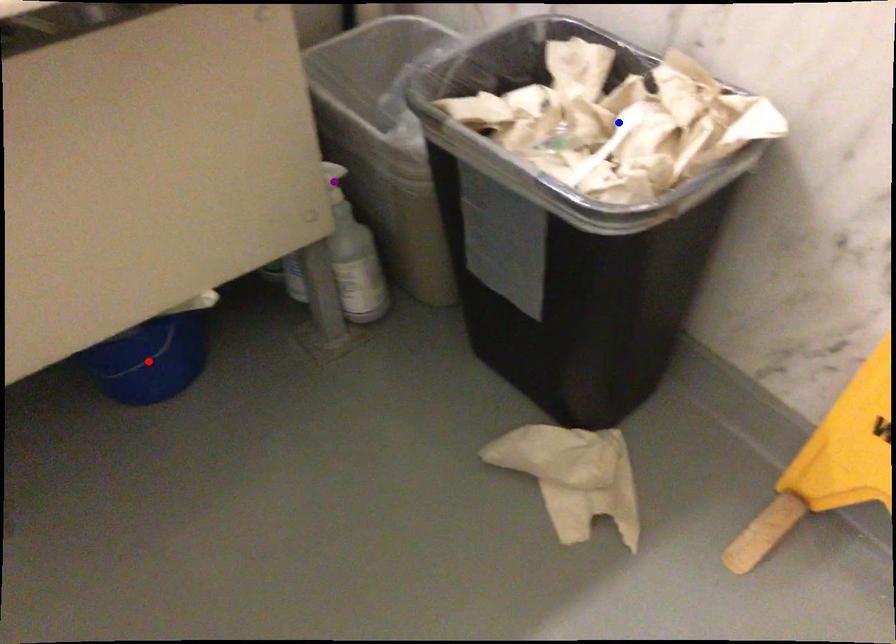
Order these from nearest to farthest:
blue point
purple point
red point

blue point → red point → purple point